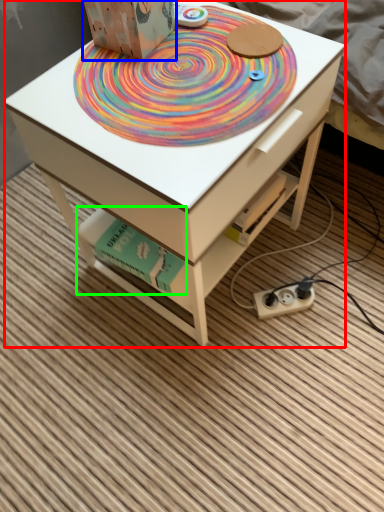
Question: Based on their relative distances, which object is farther from table (highlighted by a red box)? Choose from cardboard box (highlighted by a blue box) and book (highlighted by a green box).

Choices:
 (A) cardboard box
 (B) book

Answer: (A)